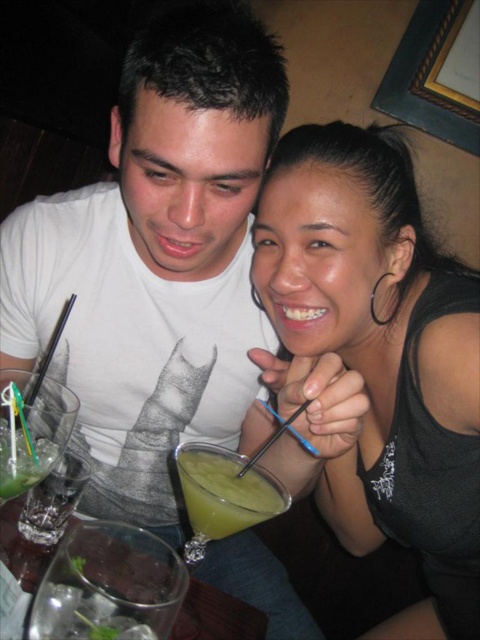
Question: Which of the following is the closest to the observer?

Choices:
 (A) black matte tank top at upper right
 (B) green translucent glass at lower left

Answer: (B)

Question: Which object is the farthest from the green translucent glass at left?

Choices:
 (A) black matte tank top at upper right
 (B) clear glass at lower left

Answer: (A)

Question: Which point is farther from the camera taking this photo?

Choices:
 (A) (244, 525)
 (B) (369, 260)

Answer: (B)

Question: Does green smoothie at center have a greater width compared to green translucent glass at lower left?

Choices:
 (A) yes
 (B) no

Answer: (A)

Question: In this image, where is black matte tank top at upper right located relative to green translucent glass at left?

Choices:
 (A) right
 (B) left

Answer: (A)

Question: Can you confirm if clear glass at lower left is positioned to the left of green translucent glass at lower left?

Choices:
 (A) yes
 (B) no

Answer: (B)